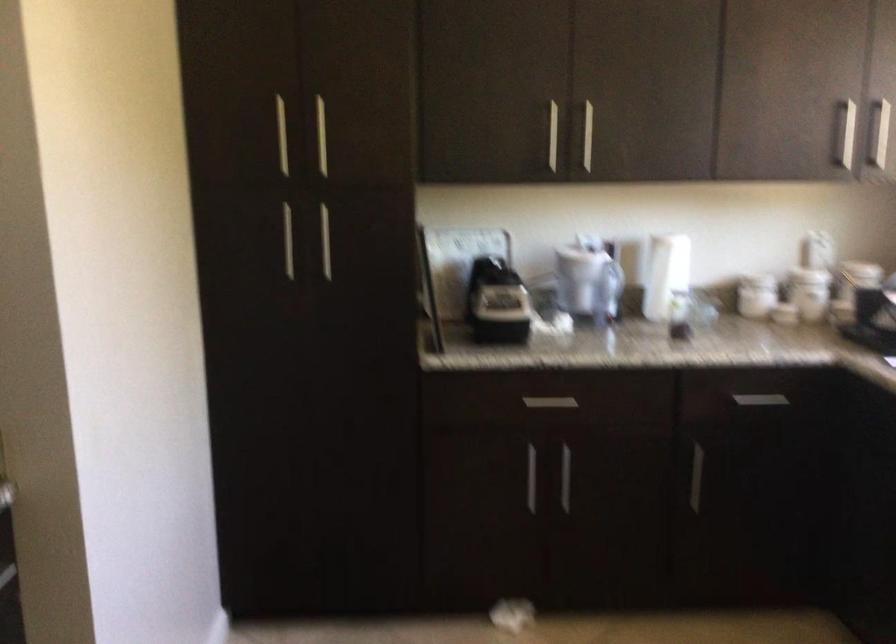
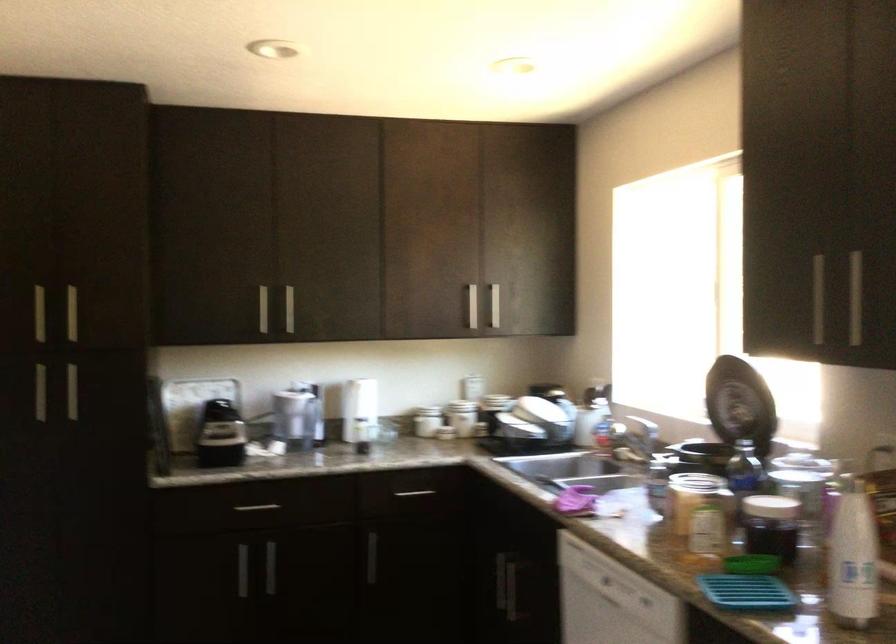
In the second image, find the point that corresponds to [821,292] in the first image.

(461, 417)